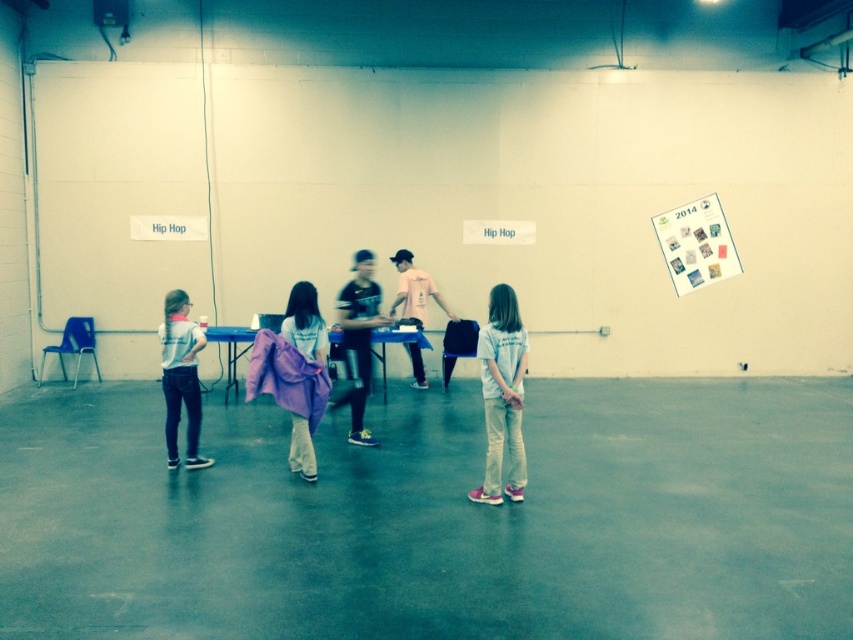
You are standing in the gymnasium and see the light gray fabric shirt at left and the pink cotton shirt at center. Which shirt is nearer to you?

The light gray fabric shirt at left is closer to the viewer than the pink cotton shirt at center.

Consider the image. You are organizing a clothing donation drive and need to sort shirts by size. You have a white cotton shirt at center and a light gray fabric shirt at left. Which shirt should you place in the large size bin?

The white cotton shirt at center is bigger than the light gray fabric shirt at left, so it should be placed in the large size bin.

In the scene shown: You are standing in the gymnasium and see the purple fabric at center. Can you estimate its exact position using a coordinate system where the bottom left corner is the origin?

The purple fabric at center is located at coordinates approximately 0.506 along the x axis and 0.359 along the y axis.